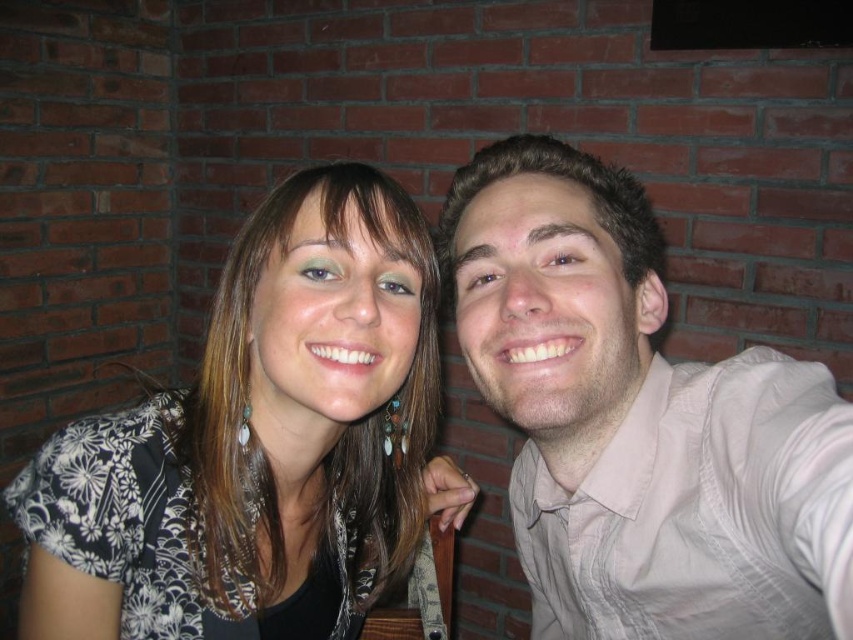
Question: Which of the following is the closest to the observer?

Choices:
 (A) (641, 323)
 (B) (410, 528)

Answer: (A)

Question: Where is floral-patterned blouse at center located in relation to light beige shirt at right in the image?

Choices:
 (A) above
 (B) below

Answer: (A)

Question: Can you confirm if floral-patterned blouse at center is positioned to the left of light beige shirt at right?

Choices:
 (A) no
 (B) yes

Answer: (B)

Question: Among these points, which one is nearest to the camera?

Choices:
 (A) (97, 422)
 (B) (816, 524)

Answer: (B)

Question: Does floral-patterned blouse at center appear on the right side of light beige shirt at right?

Choices:
 (A) no
 (B) yes

Answer: (A)